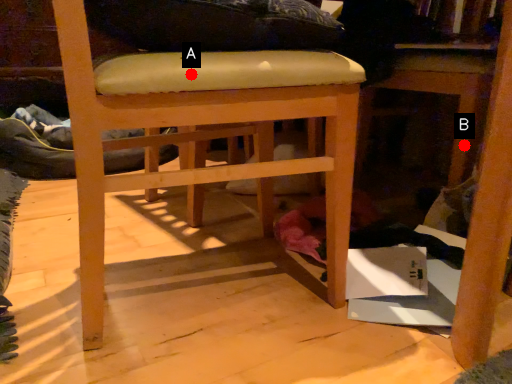
Question: Two points are circled on the image, labeled by A and B beside each circle. Which point is closer to the camera taking this photo?

Choices:
 (A) A is closer
 (B) B is closer

Answer: (A)